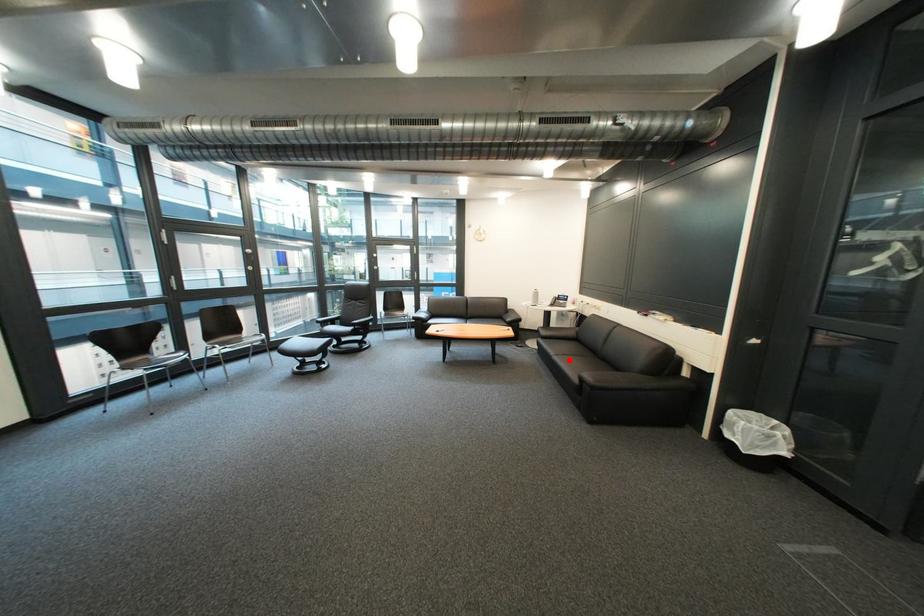
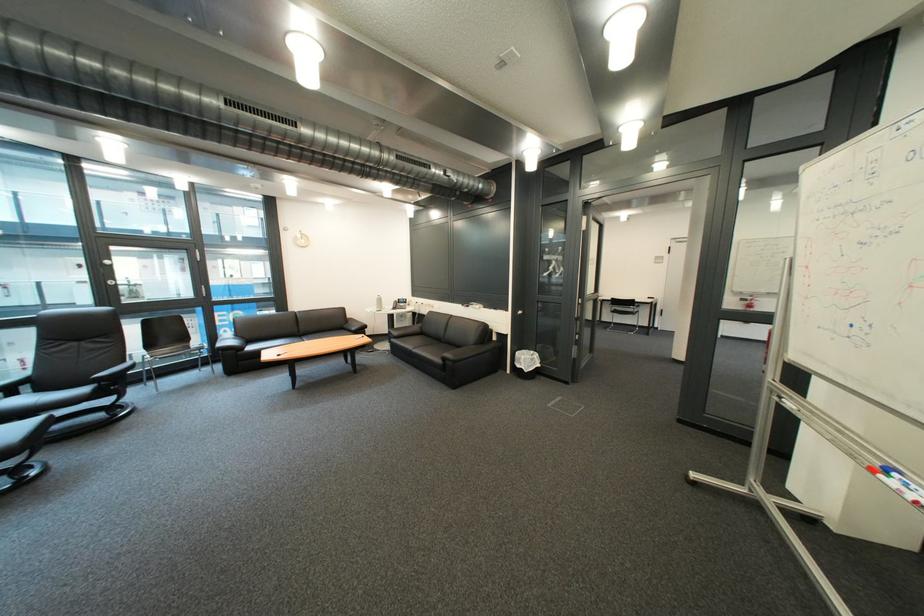
Question: I am providing you with two images of the same scene from different viewpoints. A red point is marked on the first image. Is the red point's position out of view in image 2?

Choices:
 (A) Yes
 (B) No

Answer: (B)